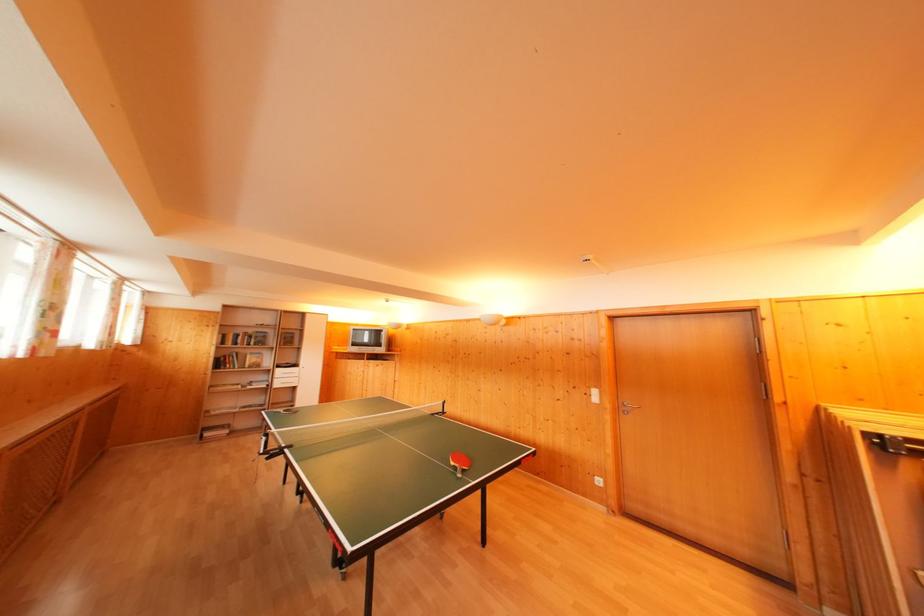
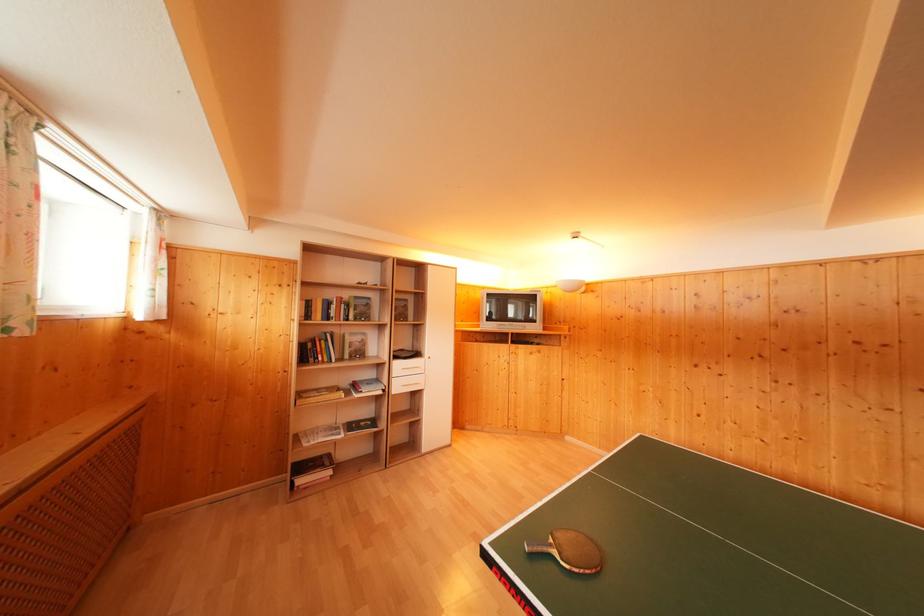
Find the pixel in the second image that matches (x=282, y=381) in the first image.

(398, 379)